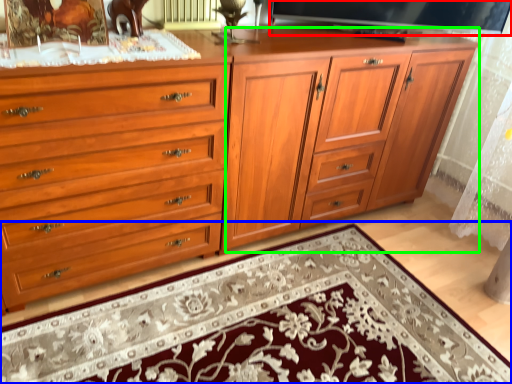
Question: Considering the real-world distances, which object is farthest from television (highlighted by a red box)? mat (highlighted by a blue box) or tv cabinet (highlighted by a green box)?

Choices:
 (A) mat
 (B) tv cabinet

Answer: (A)